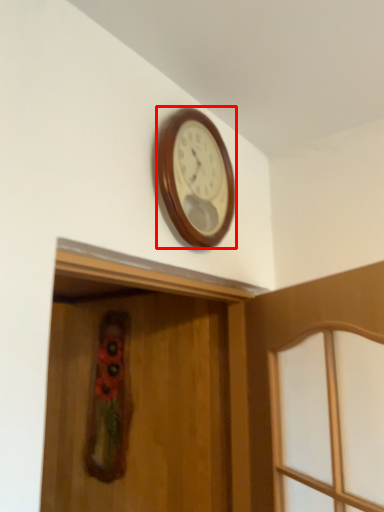
Question: Considering the relative positions of wall clock (annotated by the red box) and screen door in the image provided, where is wall clock (annotated by the red box) located with respect to the staircase?

Choices:
 (A) left
 (B) right

Answer: (B)